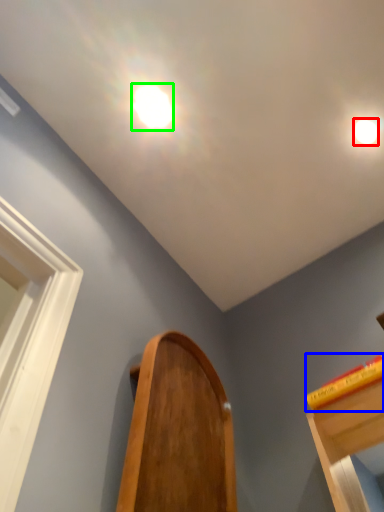
Question: Based on their relative distances, which object is nearer to droplight (highlighted by a red box)? Choose from book (highlighted by a blue box) and droplight (highlighted by a green box).

Choices:
 (A) book
 (B) droplight

Answer: (B)